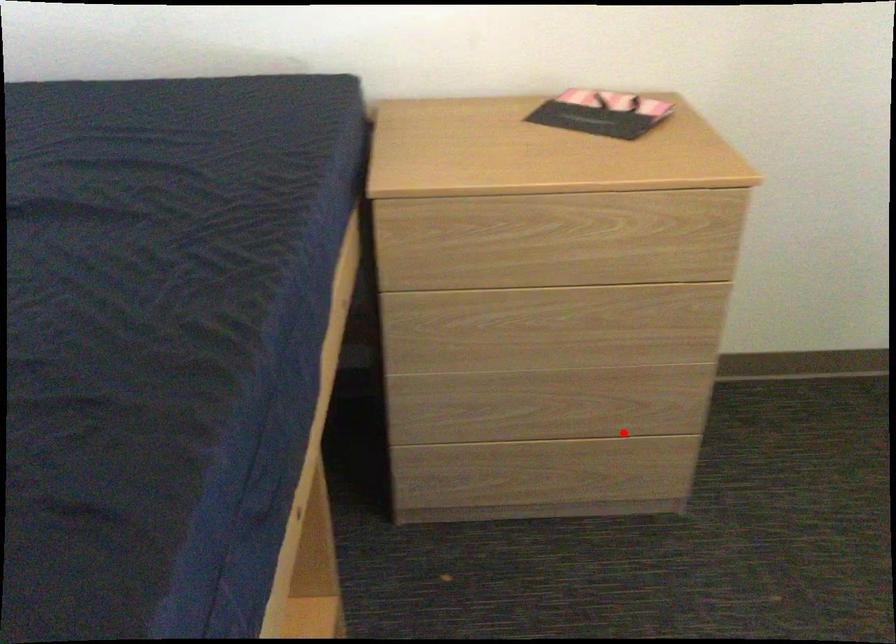
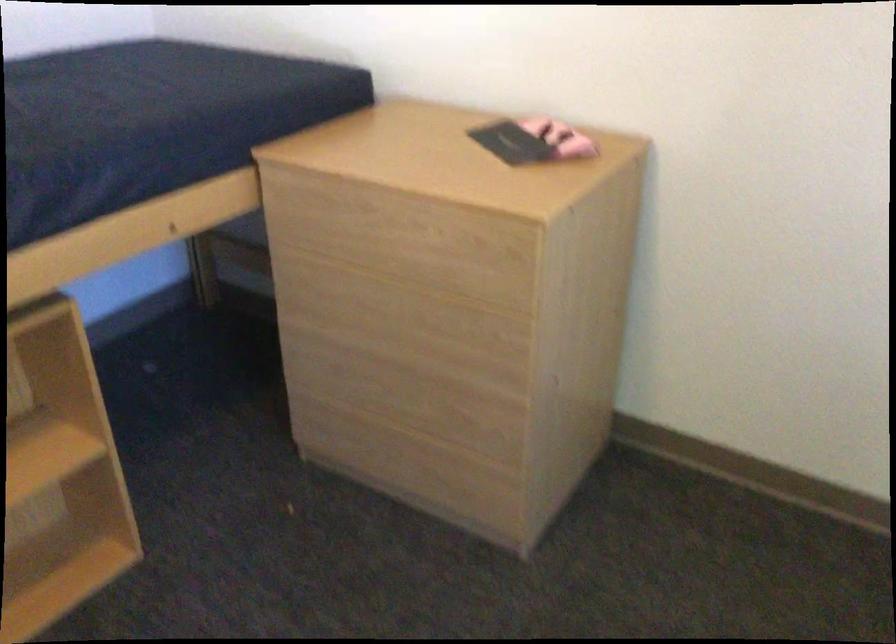
Where in the second image is the point corresponding to the highlighted location from the first image?

(451, 440)